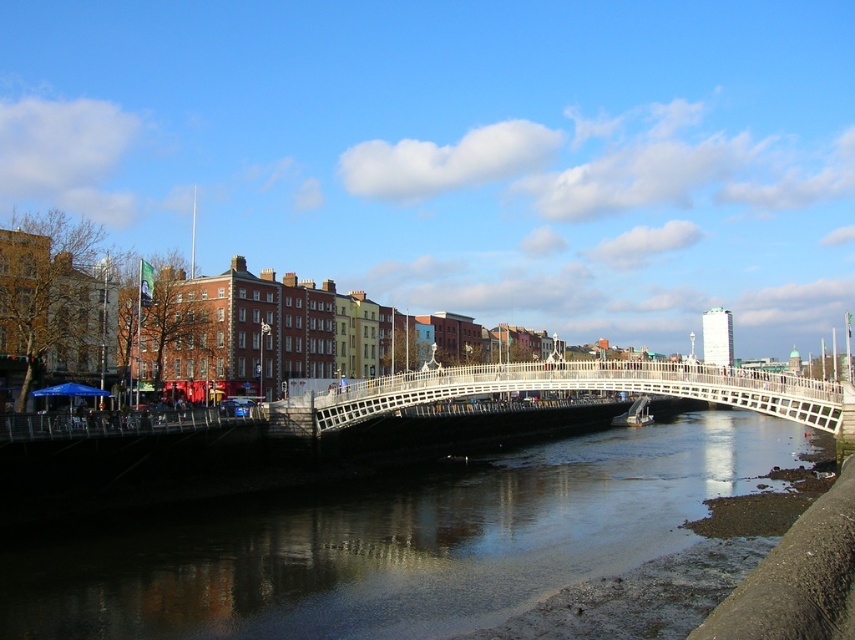
Question: Among these objects, which one is farthest from the camera?

Choices:
 (A) dark reflective water at center
 (B) white wooden bridge at center

Answer: (B)

Question: Which of the following is the closest to the observer?

Choices:
 (A) dark reflective water at center
 (B) white wooden bridge at center

Answer: (A)

Question: Does dark reflective water at center have a larger size compared to white wooden bridge at center?

Choices:
 (A) yes
 (B) no

Answer: (A)

Question: Can you confirm if dark reflective water at center is positioned above white wooden bridge at center?

Choices:
 (A) no
 (B) yes

Answer: (A)

Question: Which point is farther from the camera taking this photo?

Choices:
 (A) (714, 492)
 (B) (779, 417)

Answer: (A)

Question: Is dark reflective water at center bigger than white wooden bridge at center?

Choices:
 (A) no
 (B) yes

Answer: (B)